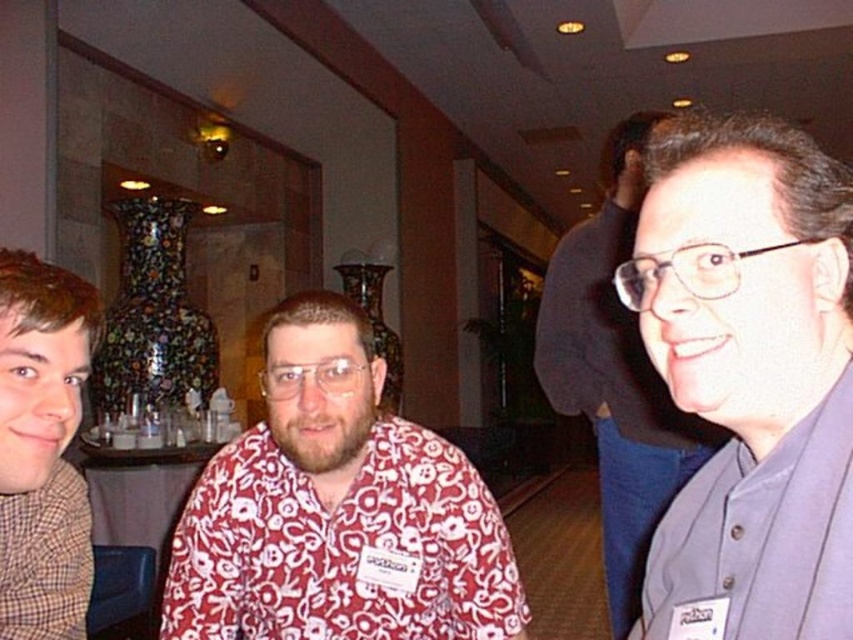
Question: Can you confirm if floral-patterned shirt at center is smaller than brown checkered scarf at left?

Choices:
 (A) no
 (B) yes

Answer: (A)

Question: Considering the relative positions of floral-patterned shirt at center and brown checkered scarf at left in the image provided, where is floral-patterned shirt at center located with respect to brown checkered scarf at left?

Choices:
 (A) above
 (B) below

Answer: (B)

Question: Which of the following is the closest to the observer?

Choices:
 (A) pyautogui.click(x=830, y=612)
 (B) pyautogui.click(x=252, y=515)

Answer: (A)

Question: Does blue cotton shirt at right appear on the right side of brown checkered scarf at left?

Choices:
 (A) no
 (B) yes

Answer: (B)

Question: Which is nearer to the floral-patterned shirt at center?

Choices:
 (A) blue cotton shirt at right
 (B) gray fabric shirt at right
 (C) brown checkered scarf at left

Answer: (C)

Question: Among these objects, which one is nearest to the camera?

Choices:
 (A) blue cotton shirt at right
 (B) gray fabric shirt at right

Answer: (A)